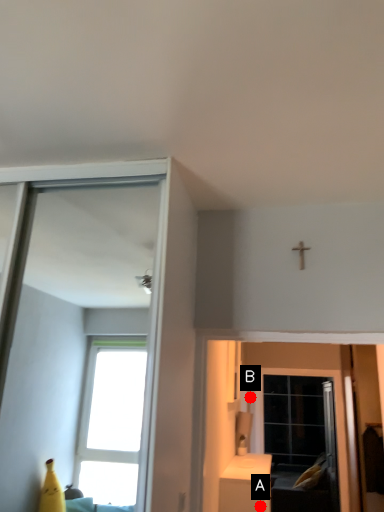
Question: Two points are circled on the image, labeled by A and B beside each circle. Which point is farther from the camera taking this photo?

Choices:
 (A) A is further
 (B) B is further

Answer: (B)